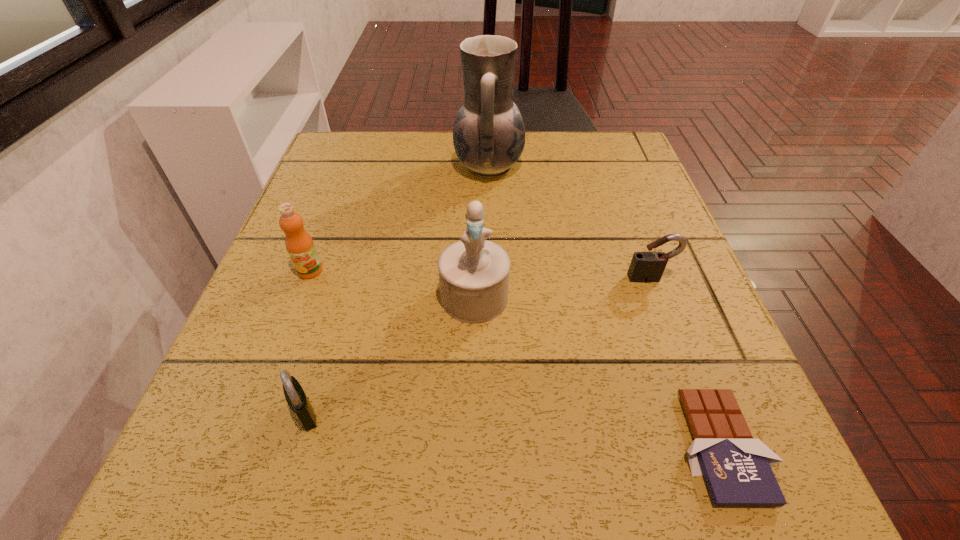
Where is `vacant region located on the front-facing side of the pitcher`? The height and width of the screenshot is (540, 960). vacant region located on the front-facing side of the pitcher is located at coordinates (319, 166).

Image resolution: width=960 pixels, height=540 pixels. I want to click on free point located on the front-facing side of the pitcher, so click(x=315, y=166).

Image resolution: width=960 pixels, height=540 pixels. What are the coordinates of `vacant area situated at the beak of the fifth shortest object` in the screenshot? It's located at (472, 475).

Identify the location of vacant position located on the front label of the leftmost object. (276, 361).

You are a GUI agent. You are given a task and a screenshot of the screen. Output one action in this format:
    pyautogui.click(x=<x>, y=<y>)
    Task: Click on the vacant space located 0.150m with the keyhole on the front of the right padlock
    The width and height of the screenshot is (960, 540).
    Given the screenshot: What is the action you would take?
    pyautogui.click(x=679, y=354)

I want to click on free spot located 0.380m on the right of the second object from left to right, so click(595, 413).

Where is `vacant area located on the back of the chocolate bar`? This screenshot has width=960, height=540. vacant area located on the back of the chocolate bar is located at coordinates (636, 221).

Where is `object that is at the far edge`? object that is at the far edge is located at coordinates (489, 134).

What are the coordinates of `object located at the near edge` in the screenshot? It's located at (737, 469).

Identify the location of orange juice located in the left edge section of the desktop. This screenshot has width=960, height=540. (299, 244).